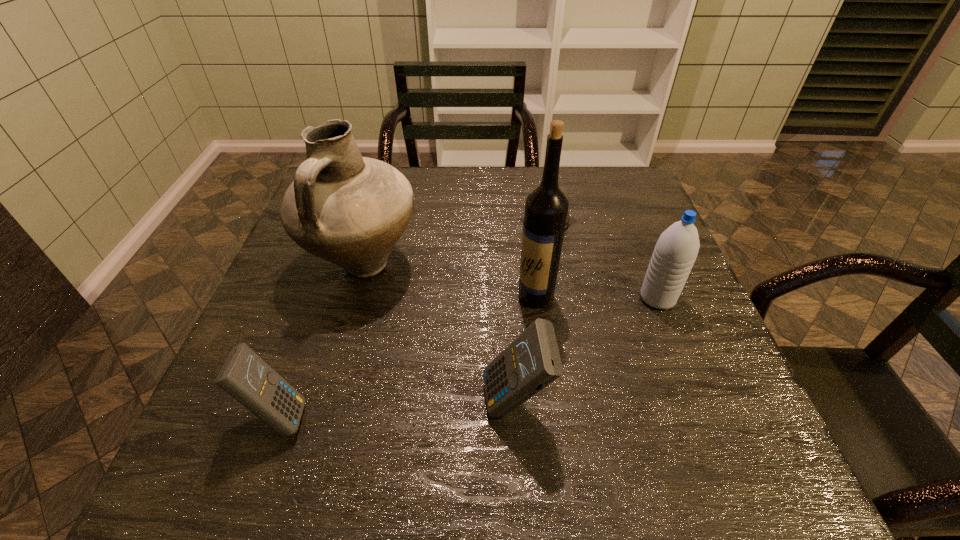
I want to click on vacant spot to place a calculator on the right, so click(x=741, y=390).